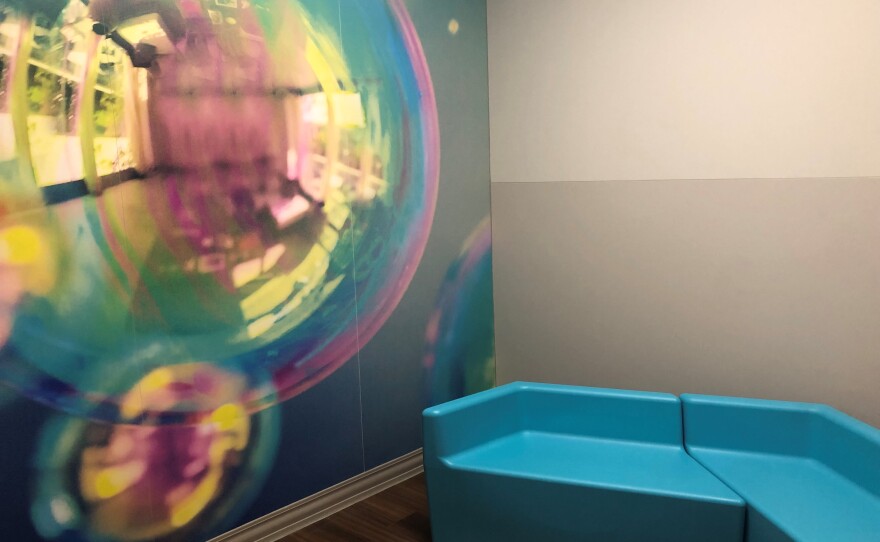
In order to click on left wall in this screenshot , I will do `click(429, 138)`.